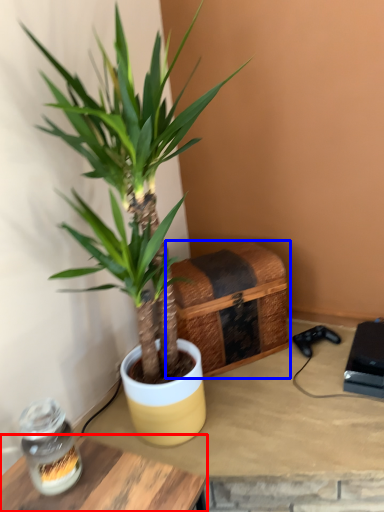
Question: Which of the following is the closest to the observer, table (highlighted by a red box) or crate (highlighted by a blue box)?

Choices:
 (A) table
 (B) crate

Answer: (A)